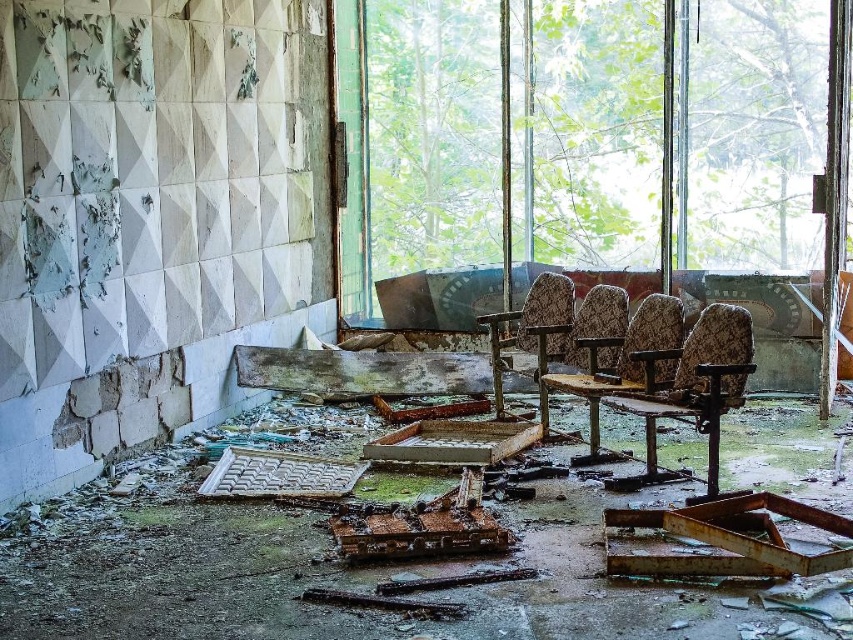
You are standing in the middle of the room and see two chairs at the center. The camouflage fabric chair at center and the patterned fabric chair at center. Which one is positioned to the right?

The camouflage fabric chair at center is to the right of the patterned fabric chair at center.